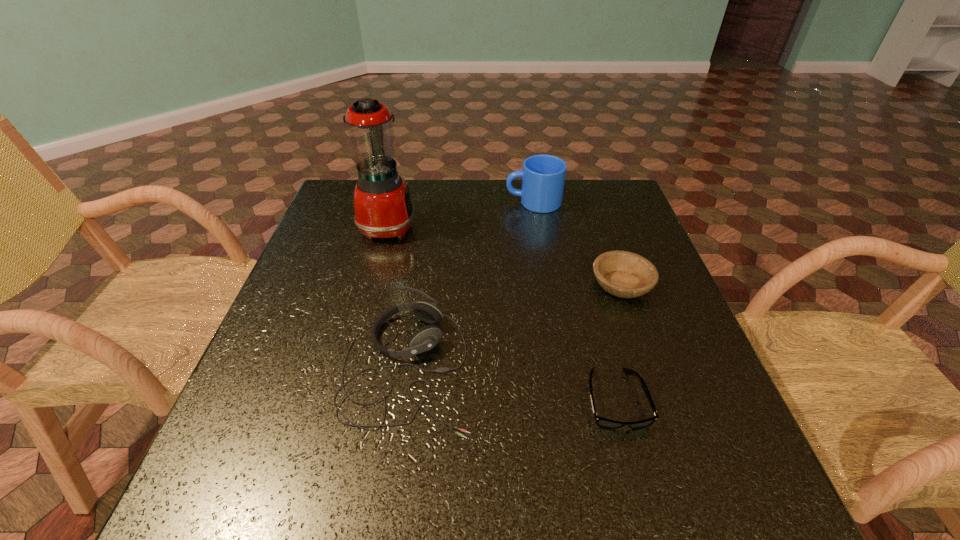
You are a GUI agent. You are given a task and a screenshot of the screen. Output one action in this format:
    pyautogui.click(x=<x>, y=<y>)
    Task: Click on the vacant space at the left edge of the desktop
    The image size is (960, 540).
    Given the screenshot: What is the action you would take?
    pyautogui.click(x=292, y=414)

Locate an element on the screen. free space at the right edge of the desktop is located at coordinates (646, 243).

This screenshot has height=540, width=960. What are the coordinates of `vacant space at the far left corner of the desktop` in the screenshot? It's located at (339, 207).

I want to click on free spot at the near left corner of the desktop, so click(291, 481).

Where is `vacant region at the far right corner`? The image size is (960, 540). vacant region at the far right corner is located at coordinates (616, 213).

I want to click on empty location between the third shortest object and the sunglasses, so click(x=512, y=382).

Find the location of a particular element. free space between the bowl and the headset is located at coordinates [x=515, y=326].

In order to click on unoccupied position between the mug and the tallest object in this screenshot , I will do `click(461, 214)`.

This screenshot has height=540, width=960. I want to click on free space that is in between the second tallest object and the food processor, so click(461, 214).

Where is `free space between the third shortest object and the sunglasses`? free space between the third shortest object and the sunglasses is located at coordinates (512, 382).